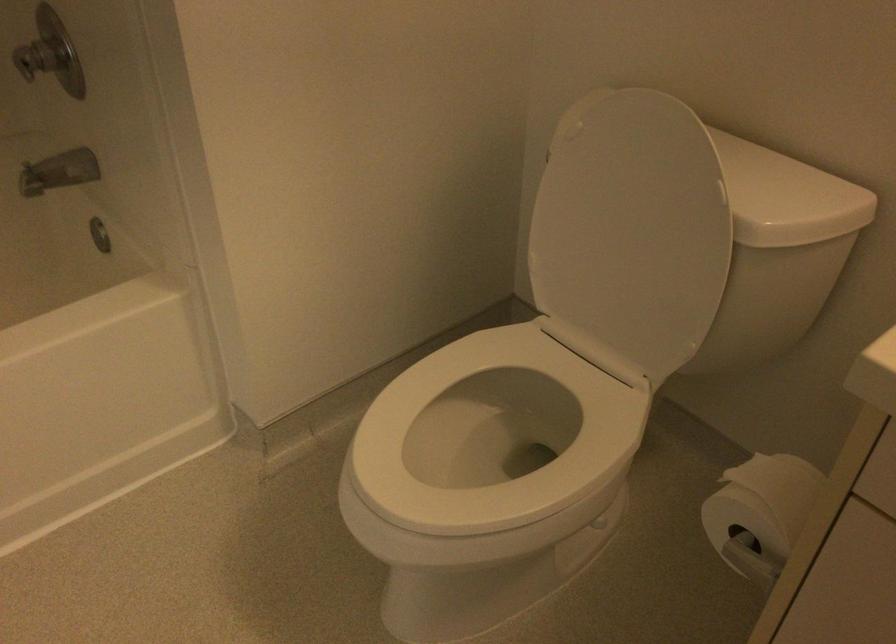
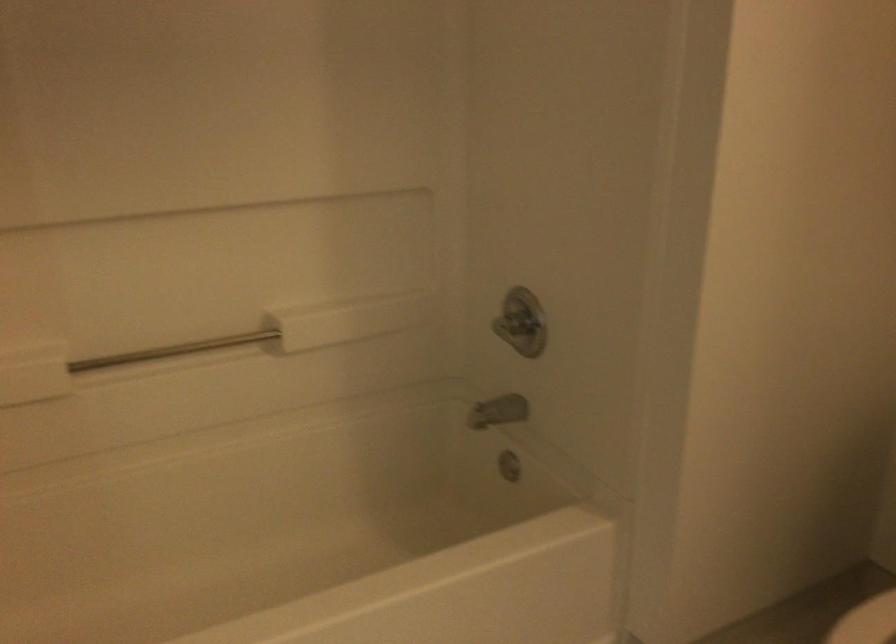
The images are taken continuously from a first-person perspective. In which direction are you moving?

The cameraman walked toward left, backward.